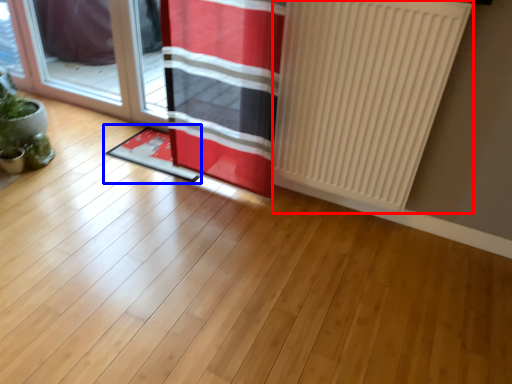
Question: Which object is further to the camera taking this photo, radiator (highlighted by a red box) or doormat (highlighted by a blue box)?

Choices:
 (A) radiator
 (B) doormat

Answer: (B)